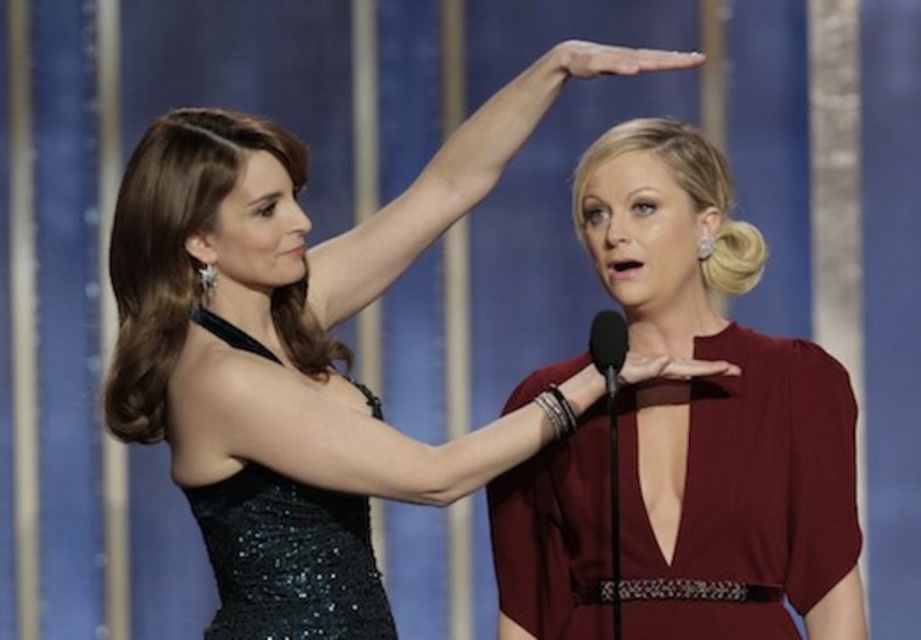
Question: Is burgundy satin dress at center to the right of black sequined dress at upper left from the viewer's perspective?

Choices:
 (A) yes
 (B) no

Answer: (A)

Question: Among these points, which one is farthest from the camera?

Choices:
 (A) (832, 497)
 (B) (277, 493)
 (C) (270, 385)

Answer: (A)

Question: Is burgundy satin dress at center below black sequined dress at upper left?

Choices:
 (A) no
 (B) yes

Answer: (A)

Question: Which point appears closest to the camera in this image?

Choices:
 (A) (325, 602)
 (B) (267, 324)
 (C) (810, 618)

Answer: (A)

Question: Can you confirm if sequined black dress at center is thinner than black sequined dress at upper left?

Choices:
 (A) yes
 (B) no

Answer: (B)

Question: Among these points, which one is nearest to the camera?

Choices:
 (A) (701, 408)
 (B) (220, 358)
 (C) (348, 596)

Answer: (B)